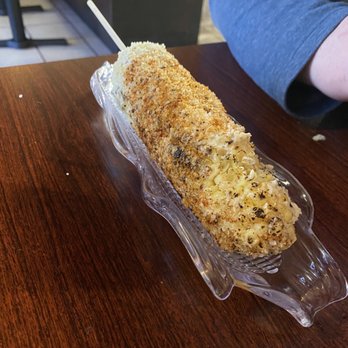
You are a GUI agent. You are given a task and a screenshot of the screen. Output one action in this format:
    pyautogui.click(x=<x>, y=<y>)
    Task: Click on the edge of brown wooden table top left
    
    Given the screenshot: What is the action you would take?
    pyautogui.click(x=22, y=62), pyautogui.click(x=61, y=62), pyautogui.click(x=95, y=55)